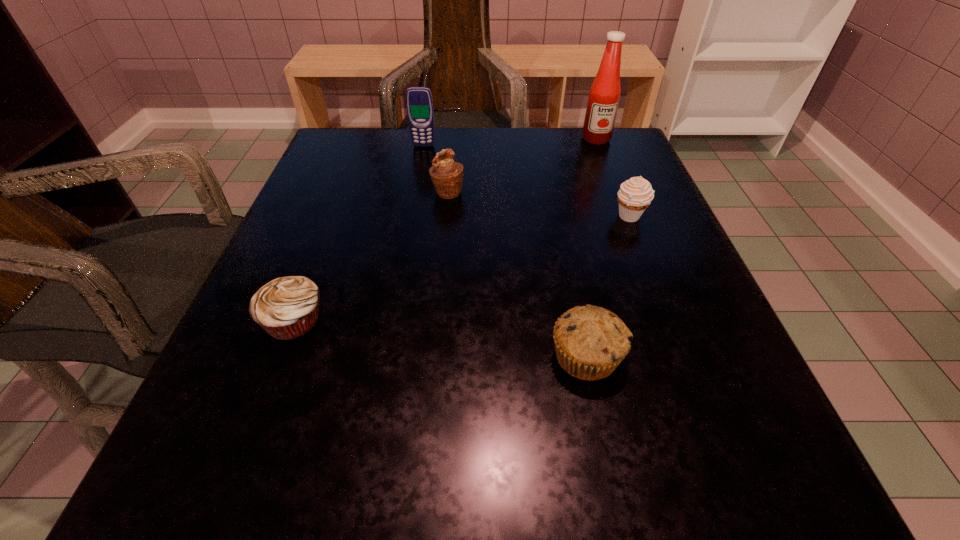
Where is `free region located 0.160m on the front-facing side of the fifth object from right to left`? The image size is (960, 540). free region located 0.160m on the front-facing side of the fifth object from right to left is located at coordinates (417, 185).

Locate an element on the screen. Image resolution: width=960 pixels, height=540 pixels. free space located on the front of the second muffin from left to right is located at coordinates (442, 256).

You are a GUI agent. You are given a task and a screenshot of the screen. Output one action in this format:
    pyautogui.click(x=<x>, y=<y>)
    Task: Click on the vacant space located 0.250m on the left of the third nearest muffin
    The image size is (960, 540).
    Given the screenshot: What is the action you would take?
    pyautogui.click(x=482, y=217)

Locate an element on the screen. This screenshot has height=540, width=960. vacant space located 0.220m on the back of the fourth object from left to right is located at coordinates (561, 234).

I want to click on vacant position located on the back of the leftmost muffin, so click(x=344, y=189).

In order to click on condiment that is at the far edge in this screenshot , I will do [604, 95].

Locate an element on the screen. The image size is (960, 540). cellular telephone that is at the far edge is located at coordinates (419, 103).

At what (x,y) coordinates should I click in order to perform the action: click on object that is at the left edge. Please return your answer as a coordinate pair (x, y). The width and height of the screenshot is (960, 540). Looking at the image, I should click on (286, 308).

At what (x,y) coordinates should I click in order to perform the action: click on condiment at the right edge. Please return your answer as a coordinate pair (x, y). This screenshot has width=960, height=540. Looking at the image, I should click on (604, 95).

Locate an element on the screen. The height and width of the screenshot is (540, 960). object that is at the far right corner is located at coordinates (604, 95).